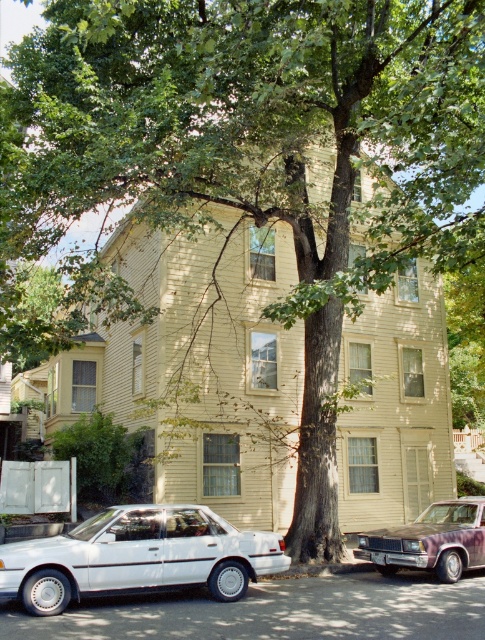
Question: Can you confirm if white matte sedan at lower left is positioned below purple metallic sedan at lower right?

Choices:
 (A) yes
 (B) no

Answer: (B)

Question: Can you confirm if white matte sedan at lower left is thinner than purple metallic sedan at lower right?

Choices:
 (A) yes
 (B) no

Answer: (B)

Question: Considering the relative positions of white matte sedan at lower left and purple metallic sedan at lower right in the image provided, where is white matte sedan at lower left located with respect to purple metallic sedan at lower right?

Choices:
 (A) right
 (B) left

Answer: (B)

Question: Among these objects, which one is nearest to the camera?

Choices:
 (A) white matte sedan at lower left
 (B) purple metallic sedan at lower right

Answer: (A)

Question: Among these points, which one is farthest from the camera?

Choices:
 (A) (164, 525)
 (B) (464, 524)

Answer: (B)